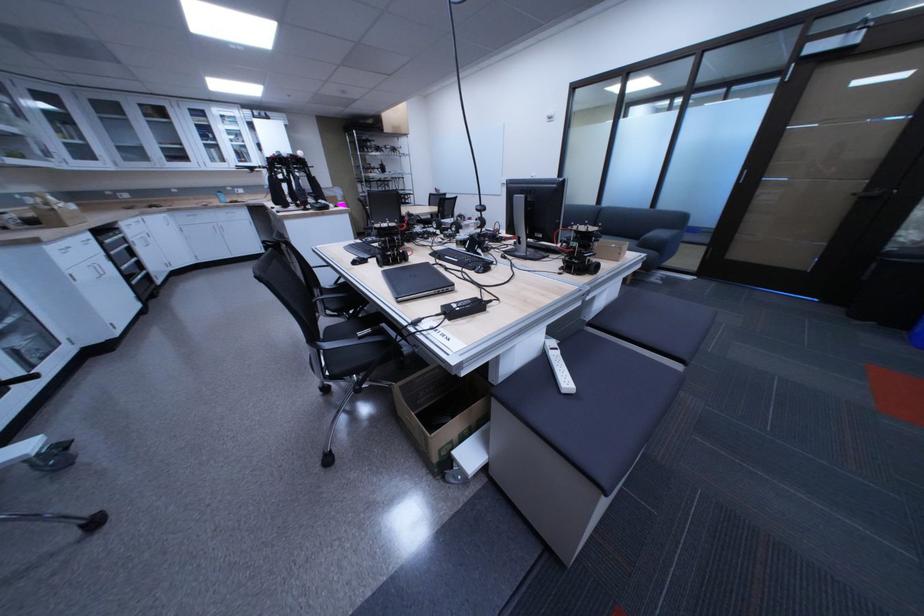
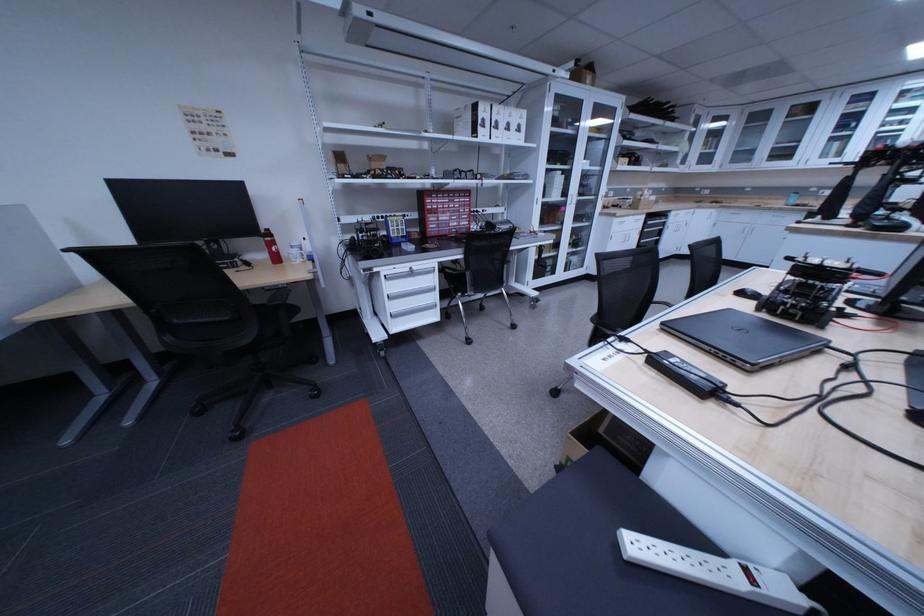
Question: I am providing you with two images of the same scene from different viewpoints. After the viewpoint changes to image2, which objects are now occluded?

Choices:
 (A) black chair armrest
 (B) white cardboard box
 (C) white drawer handle
 (D) none of these

Answer: (D)